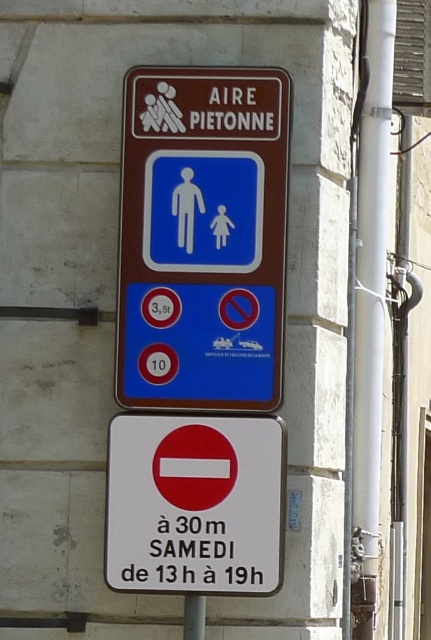
Can you confirm if matte plastic sign at center is taller than white plastic pipe at right?

In fact, matte plastic sign at center may be shorter than white plastic pipe at right.

You are a GUI agent. You are given a task and a screenshot of the screen. Output one action in this format:
    pyautogui.click(x=<x>, y=<y>)
    Task: Click on the matte plastic sign at center
    Image resolution: width=431 pixels, height=640 pixels.
    Given the screenshot: What is the action you would take?
    pyautogui.click(x=203, y=237)

Does matte plastic sign at center have a greater height compared to white plastic sign at center?

Indeed, matte plastic sign at center has a greater height compared to white plastic sign at center.

Is matte plastic sign at center positioned before white plastic sign at center?

No, matte plastic sign at center is behind white plastic sign at center.

Between point (153, 301) and point (183, 440), which one is positioned behind?

The point (153, 301) is behind.

Locate an element on the screen. The height and width of the screenshot is (640, 431). matte plastic sign at center is located at coordinates (203, 237).

Who is taller, white plastic sign at center or white plastic pipe at right?

Standing taller between the two is white plastic pipe at right.

Can you confirm if white plastic sign at center is positioned below white plastic pipe at right?

Indeed, white plastic sign at center is positioned under white plastic pipe at right.

The width and height of the screenshot is (431, 640). Identify the location of white plastic sign at center. (194, 504).